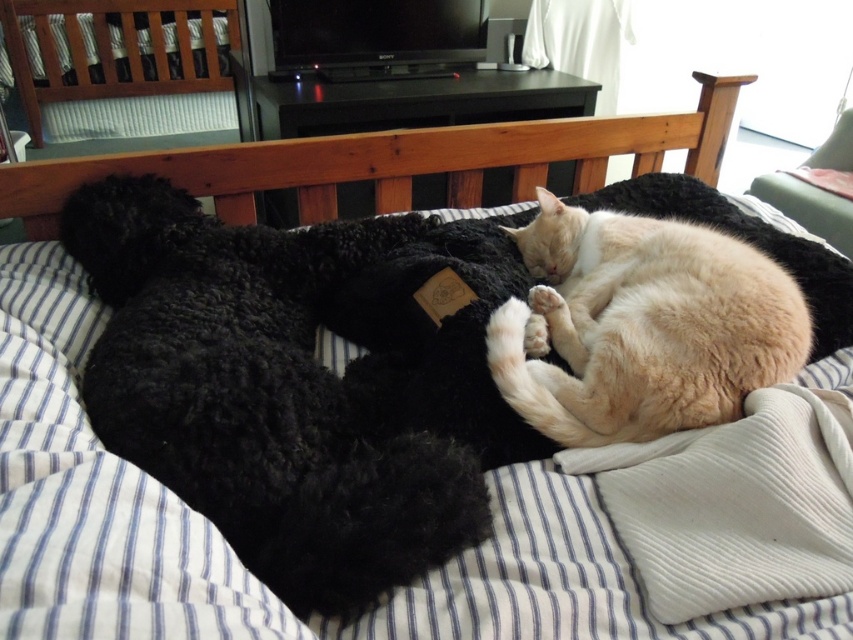
Does black fluffy dog at left appear under light beige fur cat at center?

Yes, black fluffy dog at left is below light beige fur cat at center.

Does point (340, 600) lie in front of point (694, 406)?

Yes, point (340, 600) is in front of point (694, 406).

Locate an element on the screen. black fluffy dog at left is located at coordinates (265, 394).